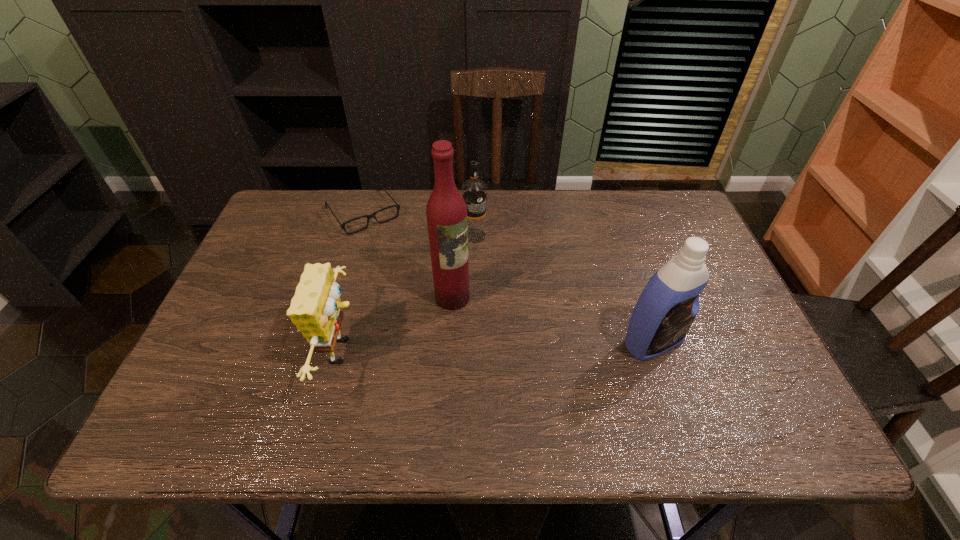
Locate an element on the screen. vacant space on the desktop that is between the sponge and the detergent and is positioned on the front-facing side of the shortest object is located at coordinates (462, 348).

You are a GUI agent. You are given a task and a screenshot of the screen. Output one action in this format:
    pyautogui.click(x=<x>, y=<y>)
    Task: Click on the free space on the desktop that is between the sponge and the rightmost object and is positioned on the label of the liquor
    The height and width of the screenshot is (540, 960).
    Given the screenshot: What is the action you would take?
    pyautogui.click(x=507, y=346)

The height and width of the screenshot is (540, 960). In order to click on free space on the desktop that is between the sponge and the detergent and is positioned on the label of the vodka in this screenshot , I will do `click(531, 346)`.